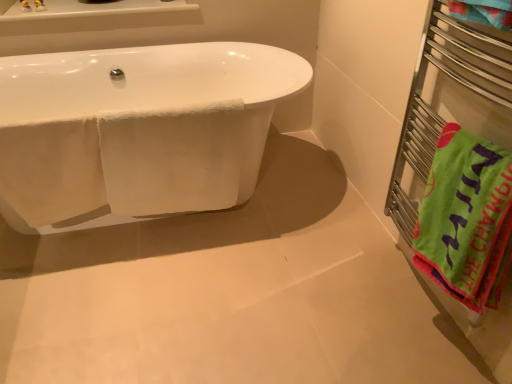
Question: From the image's perspective, is green cotton beach towel at right under metal towel rack at right?

Choices:
 (A) yes
 (B) no

Answer: (A)

Question: Are green cotton beach towel at right and metal towel rack at right beside each other?

Choices:
 (A) yes
 (B) no

Answer: (B)

Question: Is green cotton beach towel at right smaller than metal towel rack at right?

Choices:
 (A) yes
 (B) no

Answer: (A)

Question: From a real-world perspective, is green cotton beach towel at right beneath metal towel rack at right?

Choices:
 (A) no
 (B) yes

Answer: (B)

Question: Is green cotton beach towel at right shorter than metal towel rack at right?

Choices:
 (A) yes
 (B) no

Answer: (A)

Question: In the image, is white glossy bathtub at left positioned in front of or behind white ceramic window sill at upper left?

Choices:
 (A) front
 (B) behind

Answer: (A)

Question: Is white glossy bathtub at left wider or thinner than white ceramic window sill at upper left?

Choices:
 (A) wide
 (B) thin

Answer: (A)

Question: Based on their positions, is white glossy bathtub at left located to the left or right of white ceramic window sill at upper left?

Choices:
 (A) left
 (B) right

Answer: (B)

Question: Considering the positions of white glossy bathtub at left and white ceramic window sill at upper left in the image, is white glossy bathtub at left taller or shorter than white ceramic window sill at upper left?

Choices:
 (A) short
 (B) tall

Answer: (B)

Question: Considering their positions, is metal towel rack at right located in front of or behind white glossy bathtub at left?

Choices:
 (A) front
 (B) behind

Answer: (A)

Question: In terms of size, does metal towel rack at right appear bigger or smaller than white glossy bathtub at left?

Choices:
 (A) big
 (B) small

Answer: (B)

Question: Is metal towel rack at right inside or outside of white glossy bathtub at left?

Choices:
 (A) outside
 (B) inside

Answer: (A)

Question: From a real-world perspective, is metal towel rack at right physically located above or below white glossy bathtub at left?

Choices:
 (A) above
 (B) below

Answer: (A)

Question: Is point (99, 4) closer or farther from the camera than point (190, 193)?

Choices:
 (A) closer
 (B) farther

Answer: (B)

Question: From their relative heights in the image, would you say white ceramic window sill at upper left is taller or shorter than white glossy bathtub at left?

Choices:
 (A) short
 (B) tall

Answer: (A)